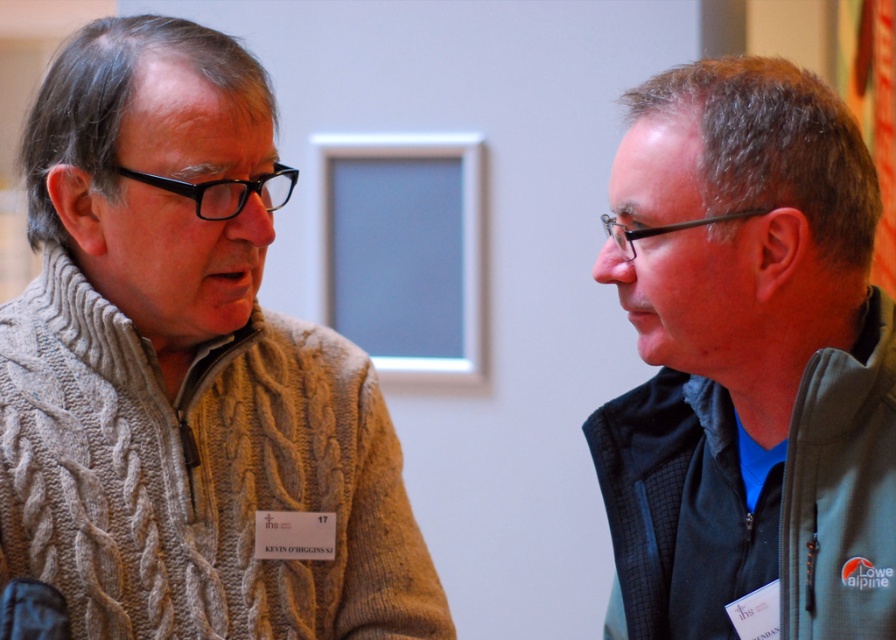
How much distance is there between knitted beige sweater at left and green fleece jacket at right?

knitted beige sweater at left is 40.53 centimeters from green fleece jacket at right.

Between knitted beige sweater at left and green fleece jacket at right, which one appears on the right side from the viewer's perspective?

Positioned to the right is green fleece jacket at right.

This screenshot has width=896, height=640. Identify the location of knitted beige sweater at left. (186, 371).